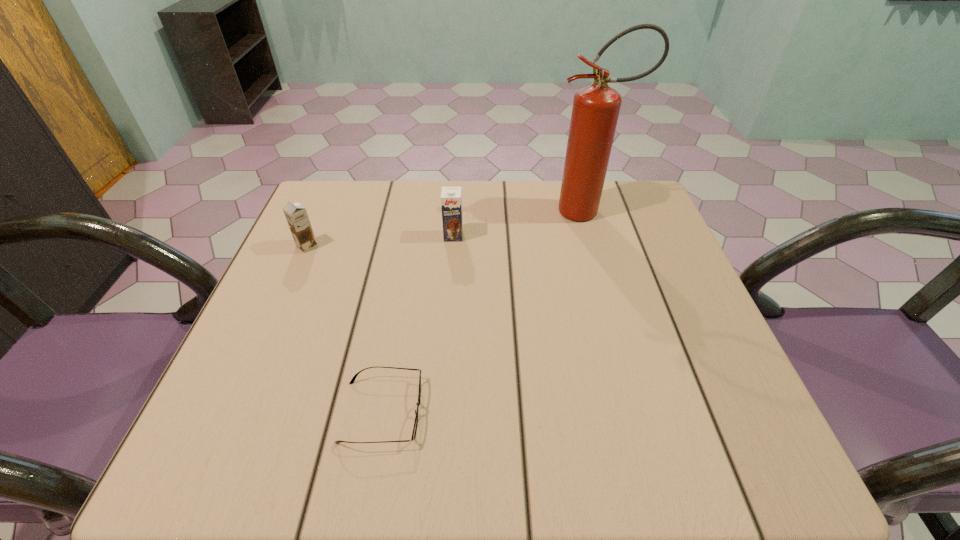
This screenshot has height=540, width=960. In order to click on free space at the left edge of the desktop in this screenshot , I will do point(346,254).

At what (x,y) coordinates should I click in order to perform the action: click on blank area at the right edge. Please return your answer as a coordinate pair (x, y). This screenshot has width=960, height=540. Looking at the image, I should click on (642, 286).

In the image, there is a desktop. Where is `vacant space at the far left corner`? Image resolution: width=960 pixels, height=540 pixels. vacant space at the far left corner is located at coordinates (345, 205).

This screenshot has height=540, width=960. In the image, there is a desktop. In order to click on vacant space at the far right corner in this screenshot , I will do `click(629, 189)`.

Where is `empty space that is in between the tallest object and the second object from left to right`? empty space that is in between the tallest object and the second object from left to right is located at coordinates (485, 312).

Identify the location of vacant area that lies between the third object from left to right and the left chocolate milk. (380, 241).

The height and width of the screenshot is (540, 960). I want to click on free point between the spectacles and the leftmost object, so click(x=345, y=329).

The width and height of the screenshot is (960, 540). What are the coordinates of `blank region between the right chocolate milk and the leftmost object` in the screenshot? It's located at (380, 241).

Where is `vacant area that lies between the leftmost object and the second object from left to right`? vacant area that lies between the leftmost object and the second object from left to right is located at coordinates (345, 329).

Find the location of a particular element. vacant space in between the right chocolate milk and the fire extinguisher is located at coordinates (520, 224).